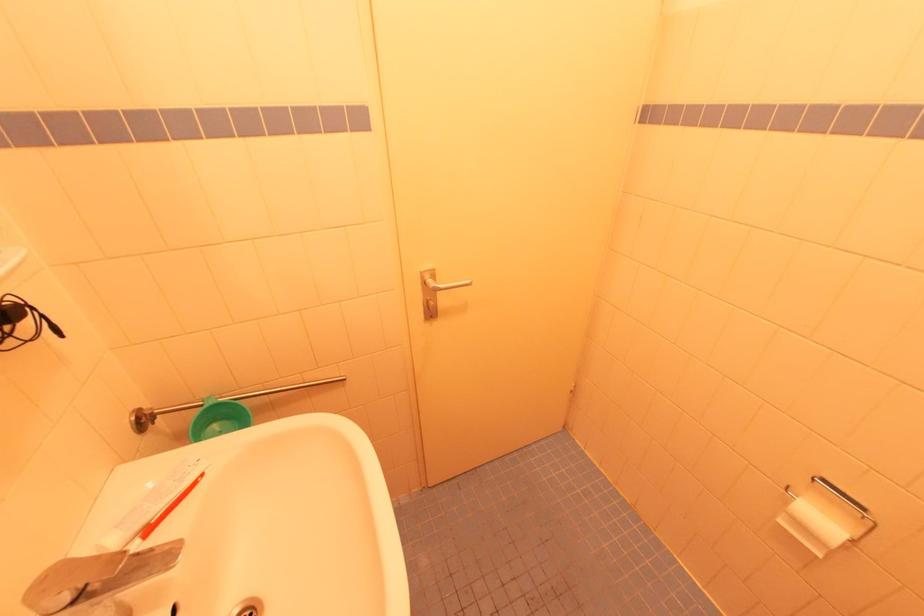
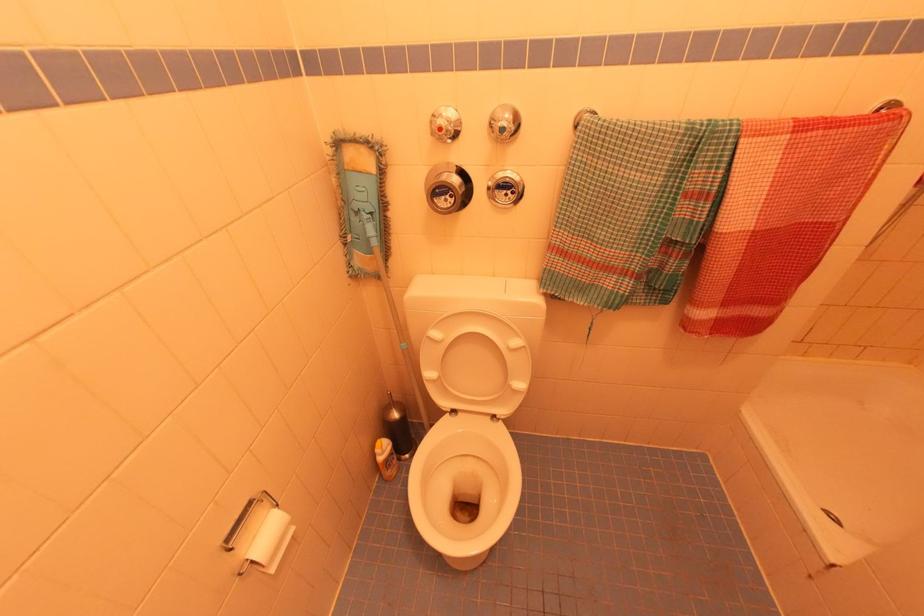
The point at (784, 523) is marked in the first image. Where is the corresponding point in the second image?

(274, 570)